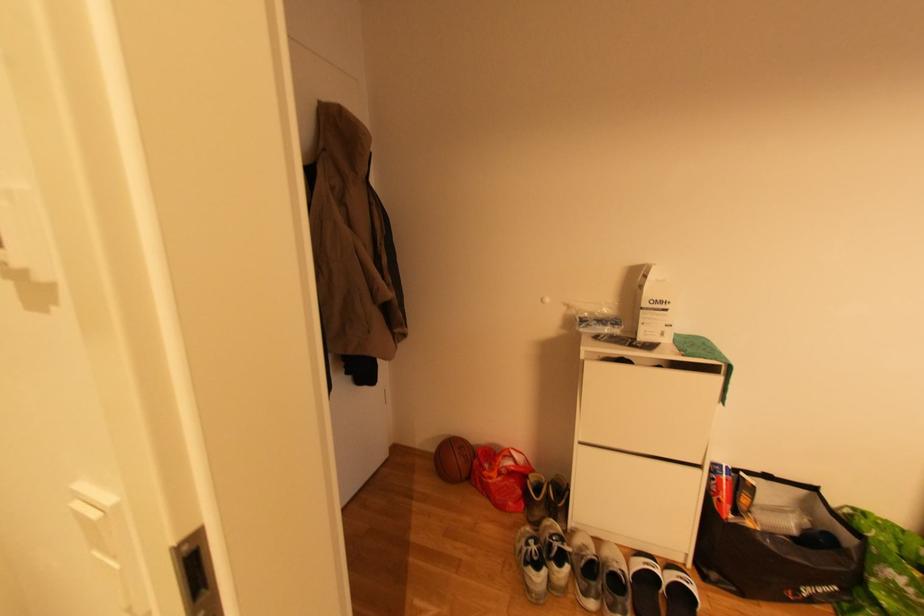
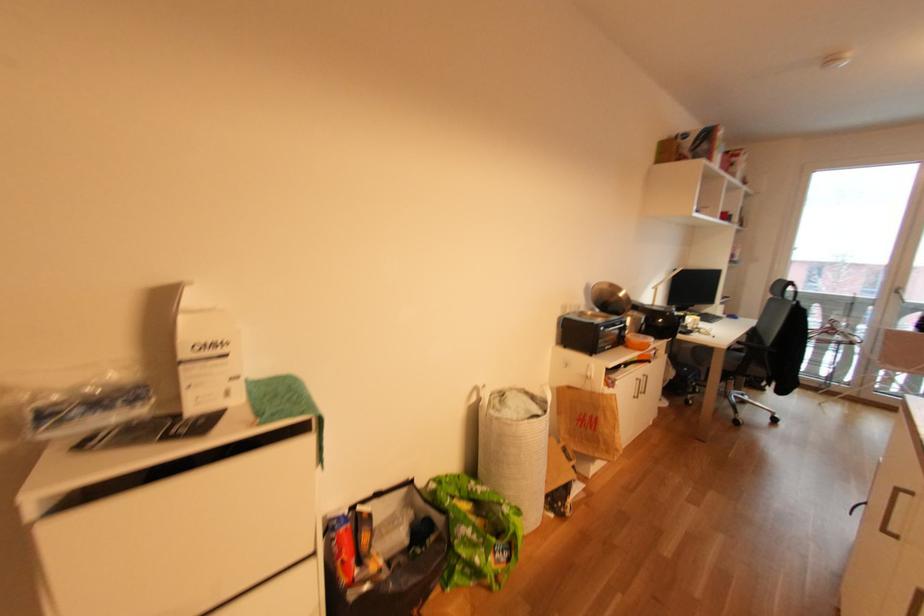
Question: The images are taken continuously from a first-person perspective. In which direction is your viewpoint rotating?

Choices:
 (A) Left
 (B) Right
 (C) Up
 (D) Down

Answer: (B)